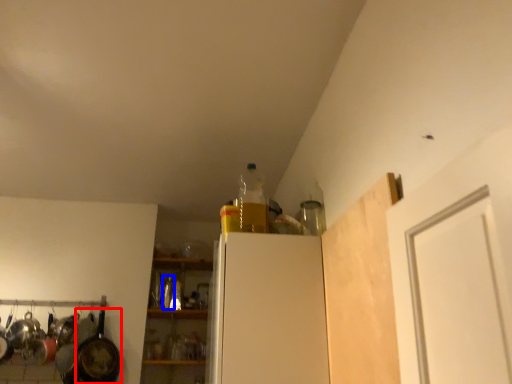
Question: Among these objects, which one is nearest to the camera, frying pan (highlighted by a red box) or bottle (highlighted by a blue box)?

Choices:
 (A) frying pan
 (B) bottle

Answer: (A)